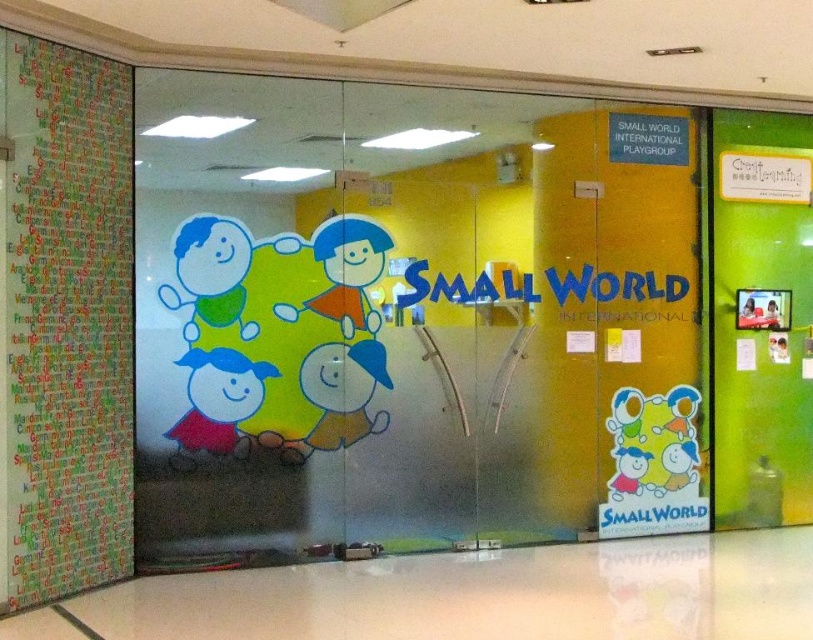
You are a parent holding a 1.5 meter wide stroller. You want to walk through the entrance of Small World International Playgroup while carrying the stroller. Can you pass through the entrance without tilting the stroller sideways? Please explain your reasoning based on the distance between the multicolored paper at left and the green matte door at right.

The distance between the multicolored paper at left and the green matte door at right is 5.08 meters. Since the stroller is only 1.5 meters wide, there is sufficient space for the stroller to pass through without needing to tilt it sideways.

You are a delivery person with a 17 feet long ladder that you need to carry through the entrance. The ladder cannot be disassembled. The entrance has a transparent glass door at center and a camera. Can you safely pass the ladder through the entrance without hitting the camera?

The transparent glass door at center and camera are 16.78 feet apart. Since the ladder is 17 feet long, which is longer than the 16.78 feet distance between the door and the camera, you cannot safely pass the ladder through the entrance without hitting the camera.